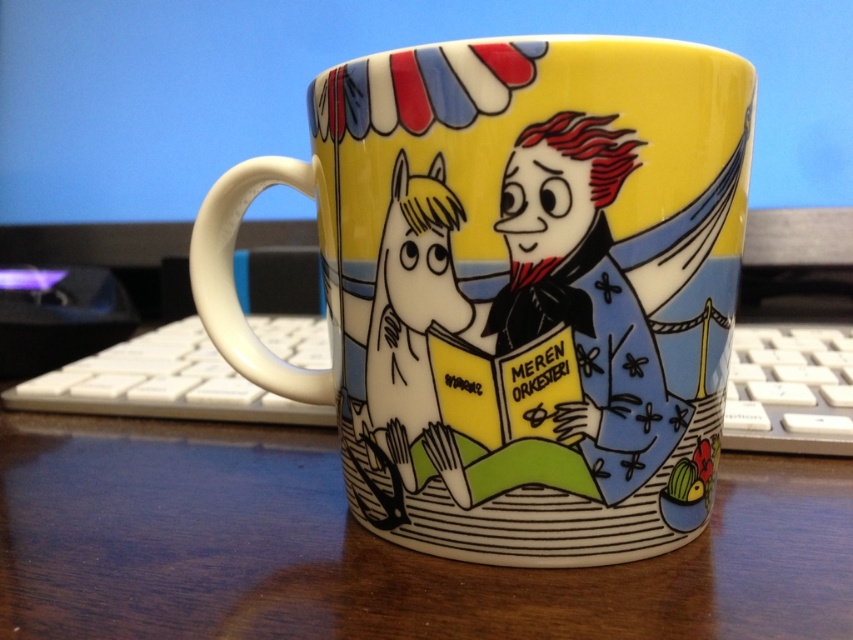
Is glossy ceramic mug at center further to the viewer compared to white plastic keyboard at lower left?

No, it is in front of white plastic keyboard at lower left.

What do you see at coordinates (514, 289) in the screenshot? I see `glossy ceramic mug at center` at bounding box center [514, 289].

Who is more forward, (680, 336) or (61, 380)?

Positioned in front is point (680, 336).

Where is `glossy ceramic mug at center`? The image size is (853, 640). glossy ceramic mug at center is located at coordinates (514, 289).

Does glossy ceramic mug at center have a smaller size compared to wooden table at center?

Incorrect, glossy ceramic mug at center is not smaller in size than wooden table at center.

This screenshot has width=853, height=640. Find the location of `glossy ceramic mug at center`. glossy ceramic mug at center is located at coordinates (514, 289).

Locate an element on the screen. This screenshot has height=640, width=853. glossy ceramic mug at center is located at coordinates (514, 289).

Can you confirm if wooden table at center is taller than white plastic keyboard at lower left?

In fact, wooden table at center may be shorter than white plastic keyboard at lower left.

The image size is (853, 640). I want to click on wooden table at center, so click(x=369, y=547).